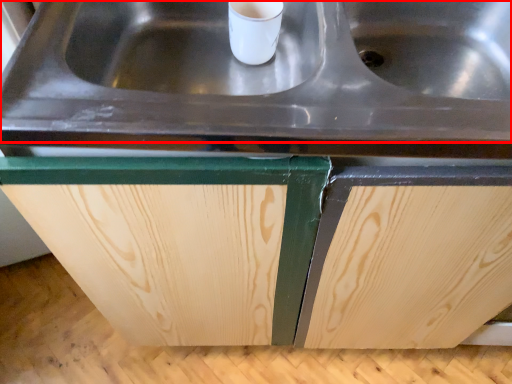
Question: From the image's perspective, where is sink (annotated by the red box) located relative to cabinetry?

Choices:
 (A) above
 (B) below

Answer: (A)